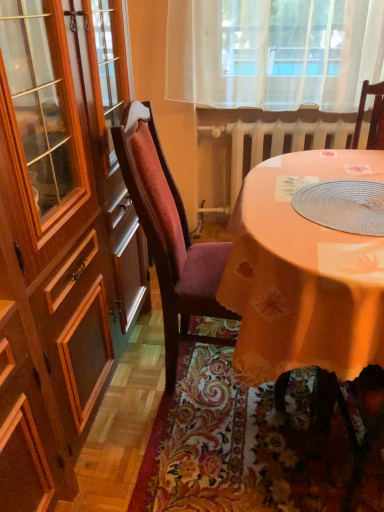
Where is `vacant area to the left of velvet burgundy chair at center`? The height and width of the screenshot is (512, 384). vacant area to the left of velvet burgundy chair at center is located at coordinates (129, 384).